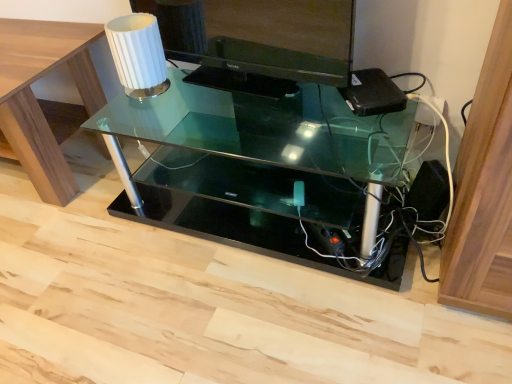
Question: Is black glossy monitor at upper center touching transparent glass table at center, which is counted as the 2th table, starting from the left?

Choices:
 (A) no
 (B) yes

Answer: (A)

Question: Is black glossy monitor at upper center at the right side of transparent glass table at center, which appears as the 1th table when viewed from the right?

Choices:
 (A) no
 (B) yes

Answer: (A)

Question: From a real-world perspective, is black glossy monitor at upper center under transparent glass table at center, which is counted as the 2th table, starting from the left?

Choices:
 (A) yes
 (B) no

Answer: (B)

Question: Is black glossy monitor at upper center behind transparent glass table at center, which appears as the 1th table when viewed from the right?

Choices:
 (A) yes
 (B) no

Answer: (A)

Question: From the image's perspective, is black glossy monitor at upper center over transparent glass table at center, which is counted as the 2th table, starting from the left?

Choices:
 (A) no
 (B) yes

Answer: (B)

Question: Considering the positions of transparent glass table at center, which is counted as the 2th table, starting from the left, and clear glass table at upper left, the first table from the left, in the image, is transparent glass table at center, which is counted as the 2th table, starting from the left, bigger or smaller than clear glass table at upper left, the first table from the left,?

Choices:
 (A) small
 (B) big

Answer: (A)

Question: In the image, is transparent glass table at center, which is counted as the 2th table, starting from the left, positioned in front of or behind clear glass table at upper left, the first table from the left?

Choices:
 (A) behind
 (B) front

Answer: (B)

Question: In terms of height, does transparent glass table at center, which appears as the 1th table when viewed from the right, look taller or shorter compared to clear glass table at upper left, the first table from the left?

Choices:
 (A) tall
 (B) short

Answer: (B)

Question: From a real-world perspective, relative to clear glass table at upper left, positioned as the second table in right-to-left order, is transparent glass table at center, which appears as the 1th table when viewed from the right, vertically above or below?

Choices:
 (A) below
 (B) above

Answer: (A)

Question: From the image's perspective, is transparent glass table at center, which appears as the 1th table when viewed from the right, above or below white ribbed glass at upper left?

Choices:
 (A) above
 (B) below

Answer: (B)

Question: From a real-world perspective, is transparent glass table at center, which appears as the 1th table when viewed from the right, physically located above or below white ribbed glass at upper left?

Choices:
 (A) above
 (B) below

Answer: (B)

Question: Do you think transparent glass table at center, which appears as the 1th table when viewed from the right, is within white ribbed glass at upper left, or outside of it?

Choices:
 (A) inside
 (B) outside

Answer: (B)

Question: Is transparent glass table at center, which is counted as the 2th table, starting from the left, taller or shorter than white ribbed glass at upper left?

Choices:
 (A) short
 (B) tall

Answer: (B)

Question: Is white ribbed glass at upper left situated inside black glossy monitor at upper center or outside?

Choices:
 (A) inside
 (B) outside

Answer: (B)

Question: Does point pos(154,48) appear closer or farther from the camera than point pos(257,69)?

Choices:
 (A) closer
 (B) farther

Answer: (A)